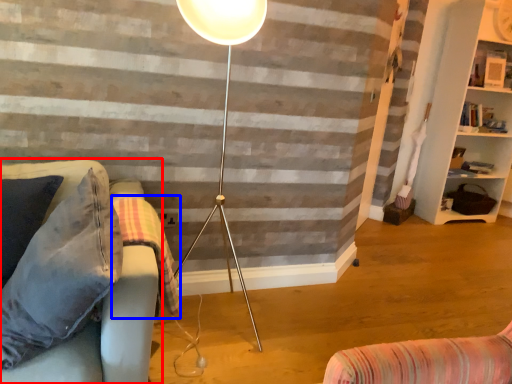
Question: Which point is closer to the camera, studio couch (highlighted by a red box) or blanket (highlighted by a blue box)?

Choices:
 (A) studio couch
 (B) blanket

Answer: (A)